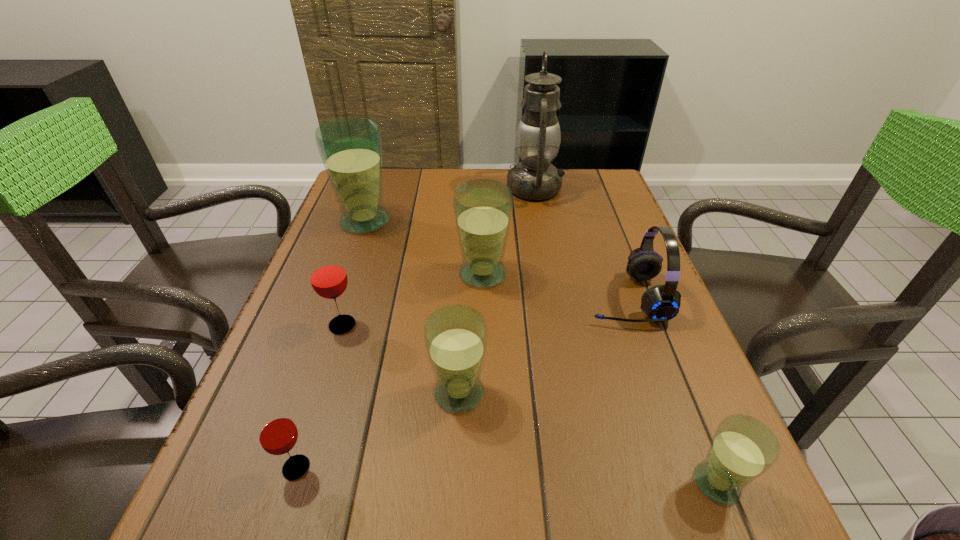
In the image, there is a desktop. Identify the location of free space at the far edge. (437, 187).

Where is `vacant space at the near edge of the desktop`? vacant space at the near edge of the desktop is located at coordinates (440, 514).

Where is `vacant space at the left edge`? vacant space at the left edge is located at coordinates (229, 471).

The height and width of the screenshot is (540, 960). In the image, there is a desktop. In order to click on vacant area at the right edge in this screenshot , I will do `click(609, 216)`.

In the image, there is a desktop. Where is `vacant space at the near left corner`? vacant space at the near left corner is located at coordinates (240, 517).

Image resolution: width=960 pixels, height=540 pixels. Identify the location of vacant area at the far right corner. (599, 182).

Locate an element on the screen. free space between the nearest blue glass and the farther red glass is located at coordinates (530, 404).

Identify the location of free space between the bigger red glass and the rightmost blue glass. coord(530,404).

Where is `empty space that is in between the headset and the nearest blue glass`? This screenshot has width=960, height=540. empty space that is in between the headset and the nearest blue glass is located at coordinates (671, 390).

Locate an element on the screen. The height and width of the screenshot is (540, 960). blank region between the rightmost blue glass and the farther red glass is located at coordinates (530, 404).